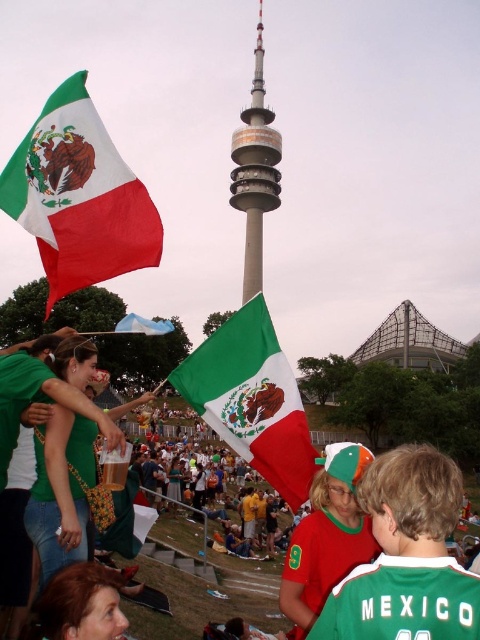
This screenshot has width=480, height=640. Describe the element at coordinates (407, 556) in the screenshot. I see `green jersey at center` at that location.

Who is positioned more to the right, green jersey at center or smooth metallic tower at center?

Positioned to the right is green jersey at center.

Who is more forward, (465, 614) or (251, 129)?

Point (465, 614) is more forward.

Find the location of a particular element. The height and width of the screenshot is (640, 480). green jersey at center is located at coordinates (407, 556).

Does red fabric flag at upper left have a smaller size compared to smooth metallic tower at center?

No.

Does red fabric flag at upper left have a lesser height compared to smooth metallic tower at center?

Correct, red fabric flag at upper left is not as tall as smooth metallic tower at center.

At what (x,y) coordinates should I click in order to perform the action: click on red fabric flag at upper left. Please return your answer as a coordinate pair (x, y). This screenshot has width=480, height=640. Looking at the image, I should click on (79, 196).

The image size is (480, 640). Describe the element at coordinates (252, 400) in the screenshot. I see `matte fabric flag at center` at that location.

Locate an element on the screen. The width and height of the screenshot is (480, 640). matte fabric flag at center is located at coordinates (252, 400).

I want to click on matte fabric flag at center, so click(x=252, y=400).

Identify the location of matte fabric flag at center. [x=252, y=400].